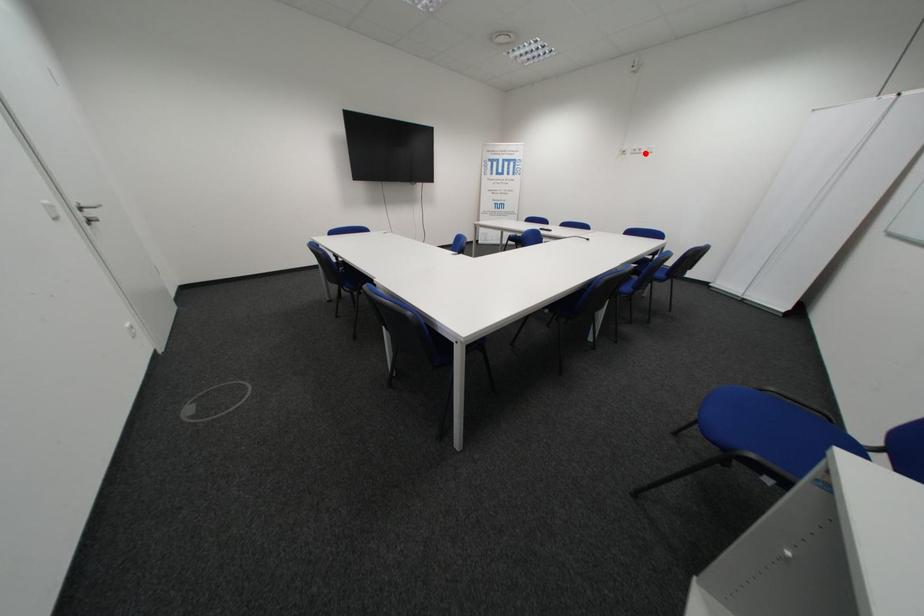
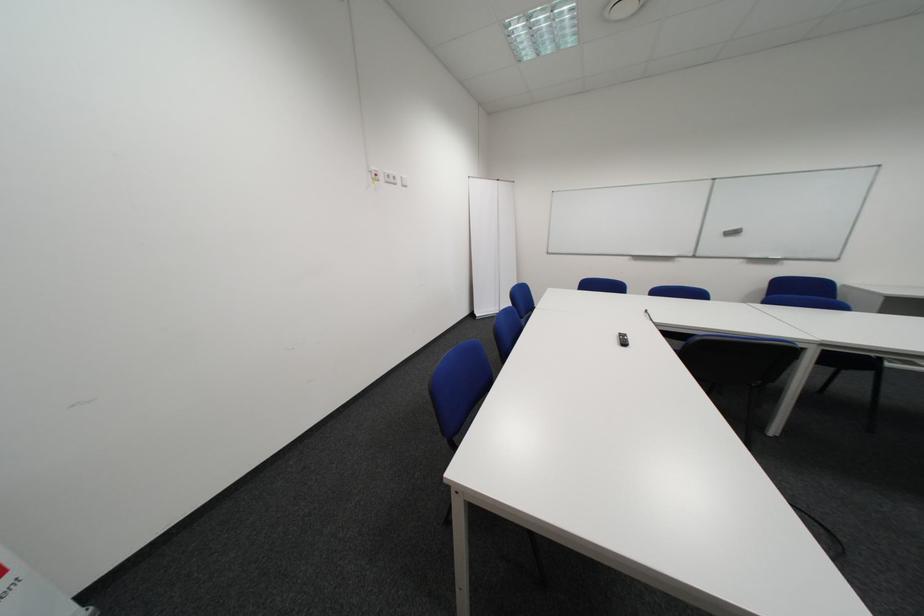
Locate, in the second image, the point that corresponds to the highlighted location in the first image.

(398, 180)